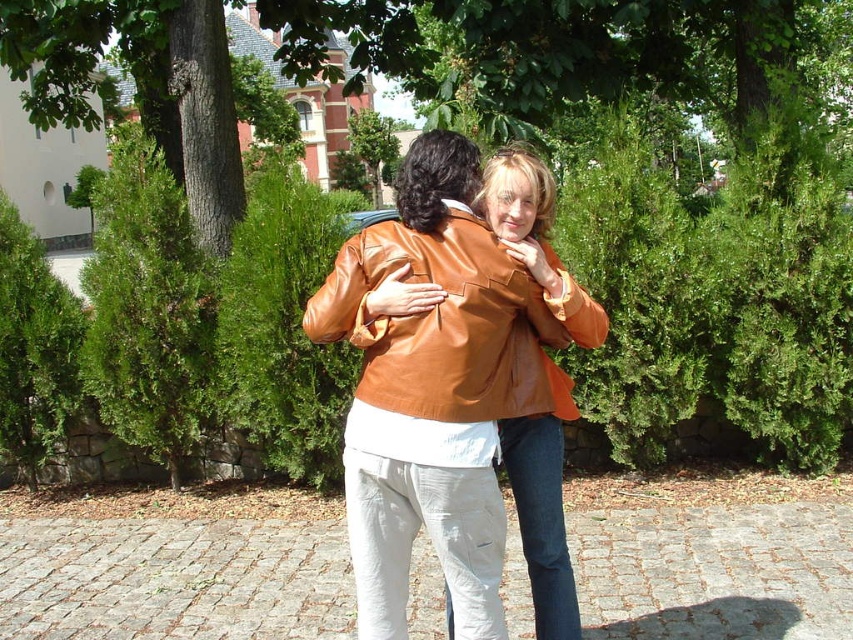
Question: Which point appears farthest from the camera in this image?

Choices:
 (A) (432, 228)
 (B) (555, 570)

Answer: (B)

Question: Which point is closer to the camera?

Choices:
 (A) (422, 392)
 (B) (418, 332)

Answer: (A)

Question: Can you confirm if matte brown leather jacket at center is wider than orange leather jacket at center?

Choices:
 (A) no
 (B) yes

Answer: (B)

Question: Which of the following is the closest to the observer?

Choices:
 (A) (447, 202)
 (B) (425, 256)

Answer: (B)

Question: Is matte brown leather jacket at center to the left of orange leather jacket at center from the viewer's perspective?

Choices:
 (A) yes
 (B) no

Answer: (A)

Question: Can you confirm if matte brown leather jacket at center is positioned to the right of shiny orange jacket at center?

Choices:
 (A) no
 (B) yes

Answer: (A)